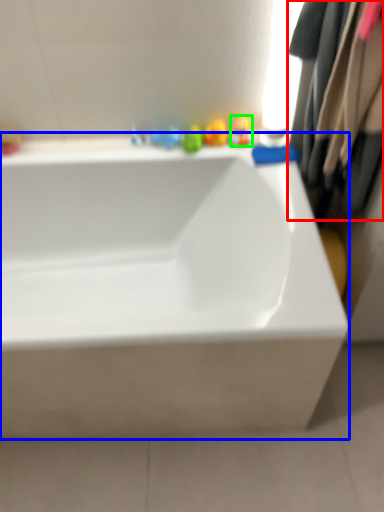
Question: Which object is the closest to the clothing (highlighted by a red box)? Choose among these: bathtub (highlighted by a blue box) or toy (highlighted by a green box).

Choices:
 (A) bathtub
 (B) toy

Answer: (B)